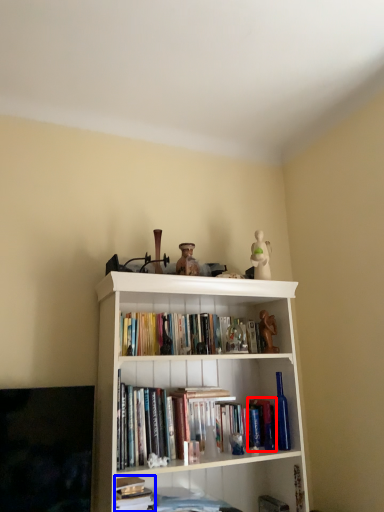
Question: Which of the following is the farthest to the observer, paperback book (highlighted by a red box) or book (highlighted by a blue box)?

Choices:
 (A) paperback book
 (B) book

Answer: (A)